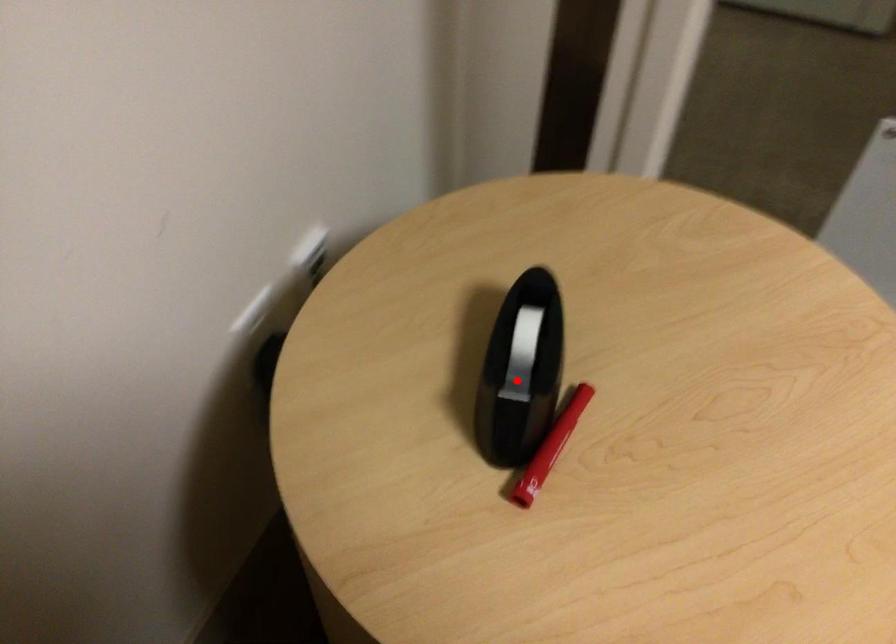
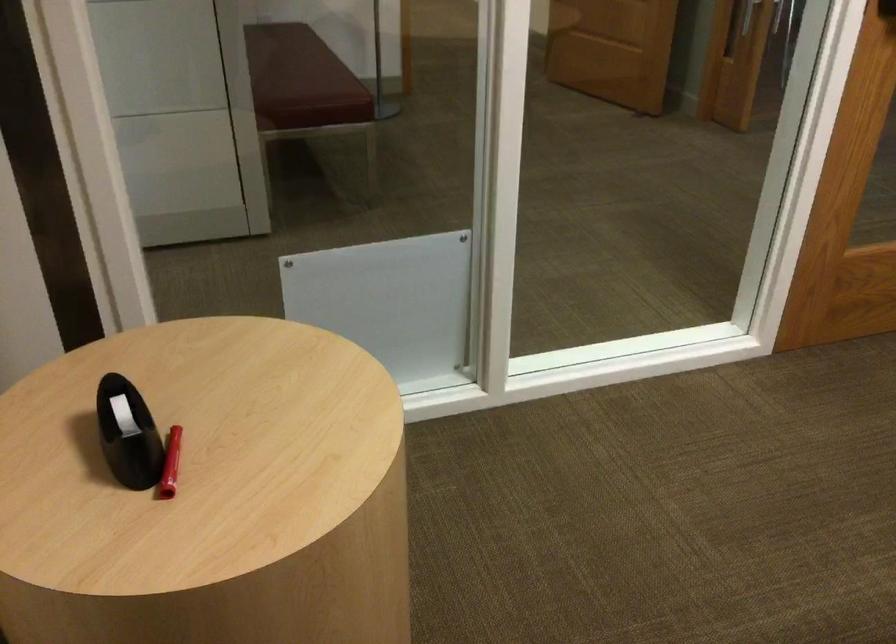
In the second image, find the point that corresponds to the highlighted location in the first image.

(127, 433)